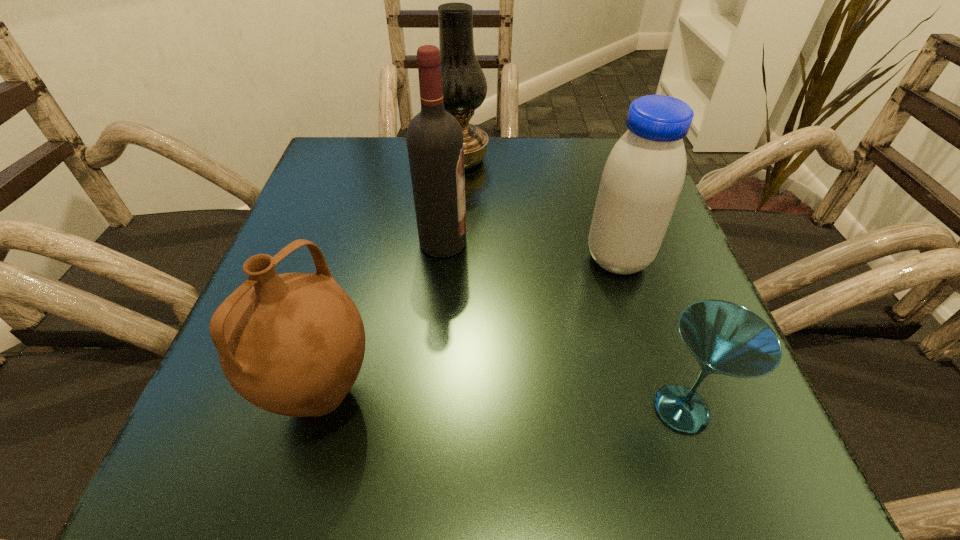
This screenshot has height=540, width=960. Identify the location of free space at the left edge. (320, 231).

In the image, there is a desktop. Where is `vacant space at the far left corner`? vacant space at the far left corner is located at coordinates (382, 152).

Image resolution: width=960 pixels, height=540 pixels. I want to click on vacant space at the near right corner of the desktop, so click(669, 480).

This screenshot has width=960, height=540. What are the coordinates of `vacant area that lies between the soya milk and the wine bottle` in the screenshot? It's located at (531, 251).

You are a GUI agent. You are given a task and a screenshot of the screen. Output one action in this format:
    pyautogui.click(x=<x>, y=<y>)
    Task: Click on the free spot between the farthest object and the soya milk
    This screenshot has width=960, height=540.
    Given the screenshot: What is the action you would take?
    coord(540,210)

Locate an element on the screen. vacant space that is in between the wine bottle and the martini is located at coordinates (563, 326).

You are a GUI agent. You are given a task and a screenshot of the screen. Output one action in this format:
    pyautogui.click(x=<x>, y=<y>)
    Task: Click on the free point between the pitcher and the shortest object
    
    Given the screenshot: What is the action you would take?
    pyautogui.click(x=502, y=402)

Where is `free point between the martini and the oil lamp`? The width and height of the screenshot is (960, 540). free point between the martini and the oil lamp is located at coordinates (571, 284).

The image size is (960, 540). Find the location of `vacant point located between the soya milk and the oil lamp`. vacant point located between the soya milk and the oil lamp is located at coordinates [x=540, y=210].

Locate an element on the screen. This screenshot has height=540, width=960. blank region between the pitcher and the martini is located at coordinates (502, 402).